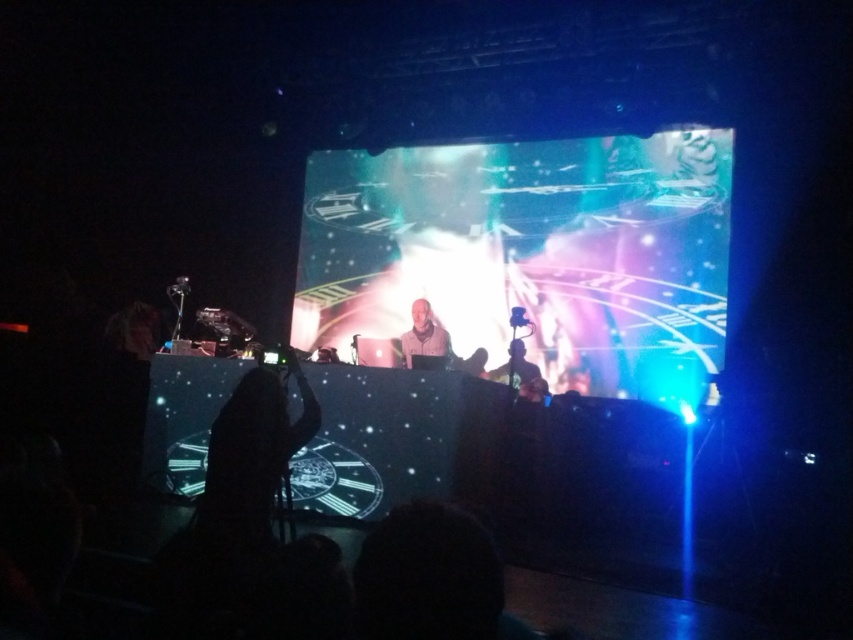
Is black fabric at center bigger than matte white headphones at center?

Yes.

Which is behind, point (287, 456) or point (422, 352)?

Positioned behind is point (422, 352).

Is point (283, 480) positioned in front of point (450, 353)?

Yes, point (283, 480) is in front of point (450, 353).

Locate an element on the screen. black fabric at center is located at coordinates (254, 449).